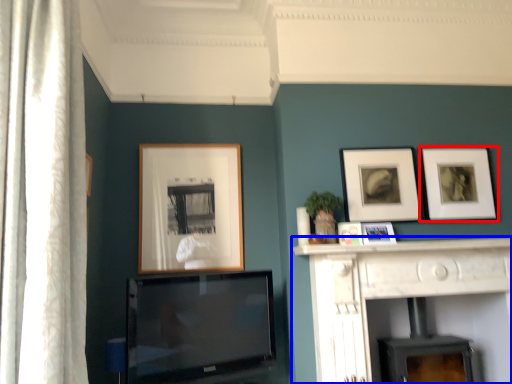
Question: Among these objects, which one is farthest to the camera, picture frame (highlighted by a red box) or fireplace (highlighted by a blue box)?

Choices:
 (A) picture frame
 (B) fireplace

Answer: (A)